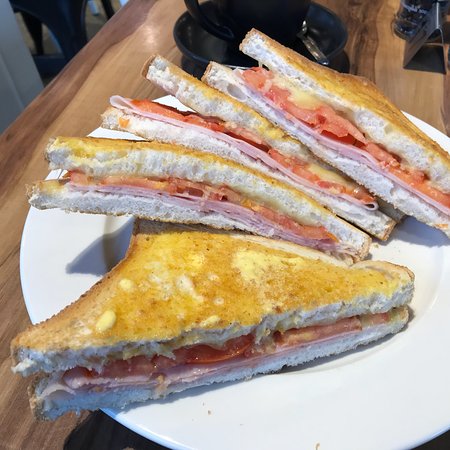
The image size is (450, 450). In order to click on wood grain table in this screenshot , I will do `click(8, 320)`, `click(15, 426)`, `click(13, 207)`.